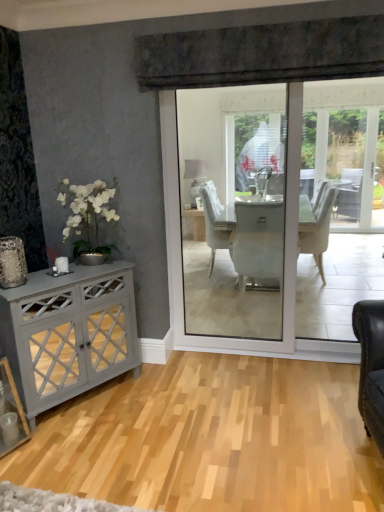
This screenshot has height=512, width=384. Describe the element at coordinates (69, 333) in the screenshot. I see `matte gray cabinet at left` at that location.

What is the approximate height of matte gray cabinet at left?

The height of matte gray cabinet at left is 32.38 inches.

Locate an element on the screen. matte gray cabinet at left is located at coordinates (69, 333).

Consider the image. Measure the distance between natural wood floor at center and camera.

A distance of 1.84 meters exists between natural wood floor at center and camera.

Image resolution: width=384 pixels, height=512 pixels. What do you see at coordinates (211, 439) in the screenshot?
I see `natural wood floor at center` at bounding box center [211, 439].

The width and height of the screenshot is (384, 512). I want to click on natural wood floor at center, so click(x=211, y=439).

Identify the location of matte gray cabinet at left. (69, 333).

Based on the photo, which object is positioned more to the left, matte gray cabinet at left or natural wood floor at center?

From the viewer's perspective, matte gray cabinet at left appears more on the left side.

Is matte gray cabinet at left closer to the viewer compared to natural wood floor at center?

No, matte gray cabinet at left is behind natural wood floor at center.

Is point (90, 328) positioned before point (128, 476)?

No.

From the image's perspective, does matte gray cabinet at left appear lower than natural wood floor at center?

No.

From a real-world perspective, is matte gray cabinet at left positioned above or below natural wood floor at center?

matte gray cabinet at left is situated higher than natural wood floor at center in the real world.

Based on the photo, is matte gray cabinet at left wider than natural wood floor at center?

Incorrect, the width of matte gray cabinet at left does not surpass that of natural wood floor at center.

Who is shorter, matte gray cabinet at left or natural wood floor at center?

natural wood floor at center.

In terms of size, does matte gray cabinet at left appear bigger or smaller than natural wood floor at center?

In the image, matte gray cabinet at left appears to be larger than natural wood floor at center.

Is matte gray cabinet at left completely or partially outside of natural wood floor at center?

Yes, matte gray cabinet at left is outside of natural wood floor at center.

Would you consider matte gray cabinet at left to be distant from natural wood floor at center?

That's not correct — matte gray cabinet at left is a little close to natural wood floor at center.

Is matte gray cabinet at left looking in the opposite direction of natural wood floor at center?

No.

How many degrees apart are the facing directions of matte gray cabinet at left and natural wood floor at center?

There is a 124-degree angle between the facing directions of matte gray cabinet at left and natural wood floor at center.

Find the location of a particular element. Image resolution: width=384 pixels, height=512 pixels. plain on the right side of matte gray cabinet at left is located at coordinates (211, 439).

In the scene shown: Between natural wood floor at center and matte gray cabinet at left, which one appears on the left side from the viewer's perspective?

Positioned to the left is matte gray cabinet at left.

In the image, is natural wood floor at center positioned in front of or behind matte gray cabinet at left?

natural wood floor at center is in front of matte gray cabinet at left.

Does point (43, 473) lie behind point (127, 339)?

No, it is in front of (127, 339).

From the image's perspective, is natural wood floor at center over matte gray cabinet at left?

Actually, natural wood floor at center appears below matte gray cabinet at left in the image.

From a real-world perspective, which object rests below the other?

From a 3D spatial view, natural wood floor at center is below.

Considering the sizes of objects natural wood floor at center and matte gray cabinet at left in the image provided, who is thinner, natural wood floor at center or matte gray cabinet at left?

matte gray cabinet at left is thinner.

Does natural wood floor at center have a lesser height compared to matte gray cabinet at left?

Correct, natural wood floor at center is not as tall as matte gray cabinet at left.

Considering the sizes of objects natural wood floor at center and matte gray cabinet at left in the image provided, who is smaller, natural wood floor at center or matte gray cabinet at left?

natural wood floor at center.

Can we say natural wood floor at center lies outside matte gray cabinet at left?

Yes, natural wood floor at center is not within matte gray cabinet at left.

Is natural wood floor at center next to matte gray cabinet at left?

No, natural wood floor at center is not next to matte gray cabinet at left.

Is natural wood floor at center turned away from matte gray cabinet at left?

That's not correct — natural wood floor at center is not looking away from matte gray cabinet at left.

Can you tell me how much natural wood floor at center and matte gray cabinet at left differ in facing direction?

124 degrees.

Locate an element on the screen. This screenshot has height=512, width=384. plain below the matte gray cabinet at left (from the image's perspective) is located at coordinates (211, 439).

Identify the location of plain that is under the matte gray cabinet at left (from a real-world perspective). [x=211, y=439].

Locate an element on the screen. The width and height of the screenshot is (384, 512). cabinetry positioned vertically above the natural wood floor at center (from a real-world perspective) is located at coordinates (69, 333).